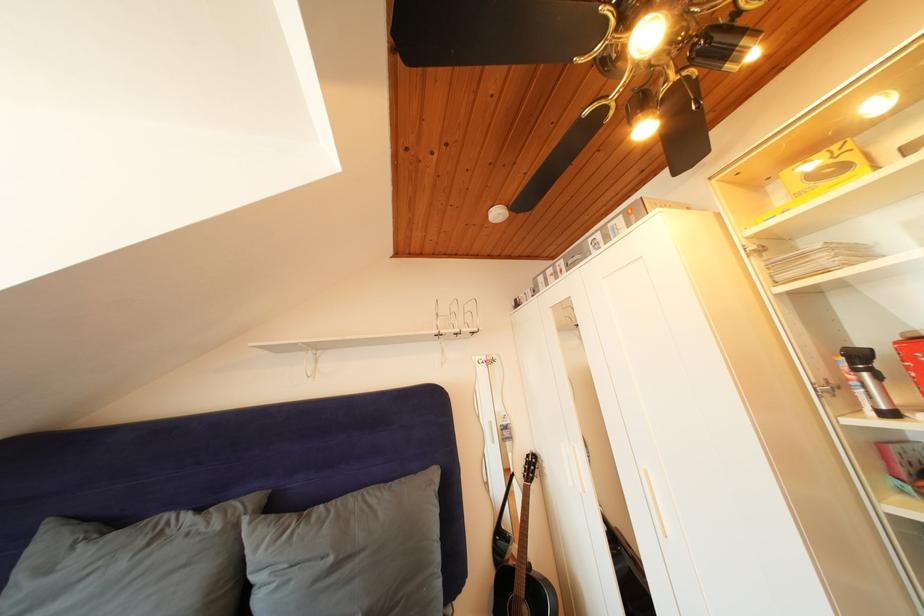
I want to click on white wire rack, so click(x=386, y=336).